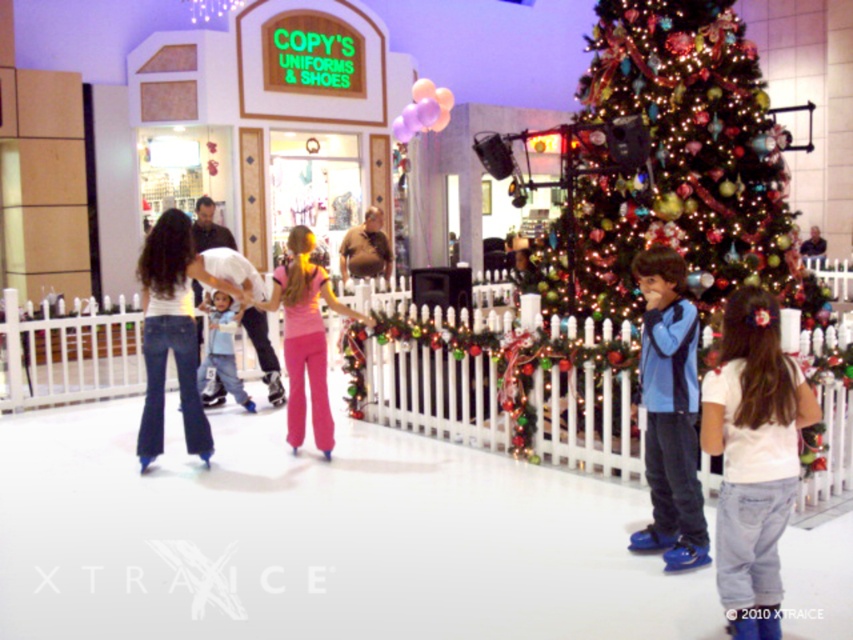
Question: Can you confirm if denim jeans at center is smaller than purple matte balloons at upper center?

Choices:
 (A) yes
 (B) no

Answer: (B)

Question: Among these objects, which one is nearest to the camera?

Choices:
 (A) shiny green christmas tree at center
 (B) light blue fabric pants at center

Answer: (A)

Question: Which object is closer to the camera taking this photo?

Choices:
 (A) blue synthetic skates at center
 (B) shiny green christmas tree at center
 (C) purple matte balloons at upper center

Answer: (A)

Question: Can you confirm if pink fabric pants at center is bigger than light blue fabric pants at center?

Choices:
 (A) yes
 (B) no

Answer: (A)

Question: Can you confirm if white cotton shirt at center is positioned below purple matte balloons at upper center?

Choices:
 (A) no
 (B) yes

Answer: (B)

Question: Based on their relative distances, which object is farther from the purple matte balloons at upper center?

Choices:
 (A) shiny green christmas tree at center
 (B) blue synthetic skates at center

Answer: (B)